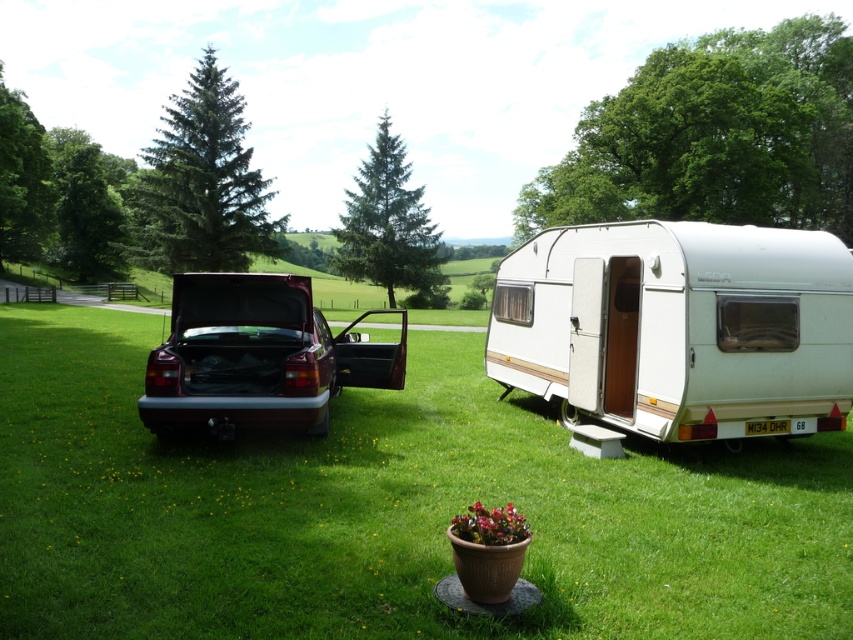
Is green grass at center to the left of maroon metallic car at center from the viewer's perspective?

No, green grass at center is not to the left of maroon metallic car at center.

Between green grass at center and maroon metallic car at center, which one appears on the left side from the viewer's perspective?

Positioned to the left is maroon metallic car at center.

Locate an element on the screen. green grass at center is located at coordinates (386, 509).

Is white plastic trailer at right to the left of maroon metallic car at center from the viewer's perspective?

Incorrect, white plastic trailer at right is not on the left side of maroon metallic car at center.

Is white plastic trailer at right positioned behind maroon metallic car at center?

Yes, it is behind maroon metallic car at center.

Describe the element at coordinates (679, 326) in the screenshot. This screenshot has height=640, width=853. I see `white plastic trailer at right` at that location.

Find the location of a particular element. The image size is (853, 640). white plastic trailer at right is located at coordinates (679, 326).

Who is positioned more to the left, green grass at center or white plastic trailer at right?

From the viewer's perspective, green grass at center appears more on the left side.

In the scene shown: Is green grass at center positioned at the back of white plastic trailer at right?

That is False.

Is point (57, 568) less distant than point (645, 296)?

Yes.

At what (x,y) coordinates should I click in order to perform the action: click on green grass at center. Please return your answer as a coordinate pair (x, y). Looking at the image, I should click on (386, 509).